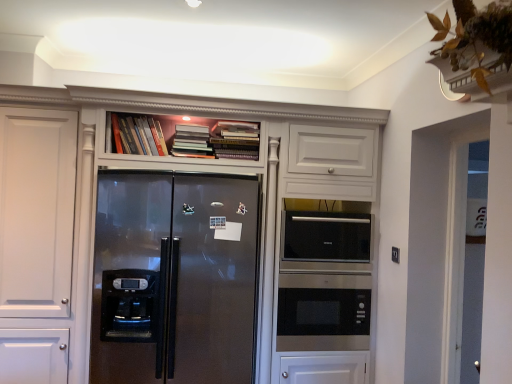
Find the location of `empty space that is ontop of hardcover books at upper center, marked as the 3th book in a right-to-left arrangement (from a real-world perspective)`. empty space that is ontop of hardcover books at upper center, marked as the 3th book in a right-to-left arrangement (from a real-world perspective) is located at coordinates (139, 114).